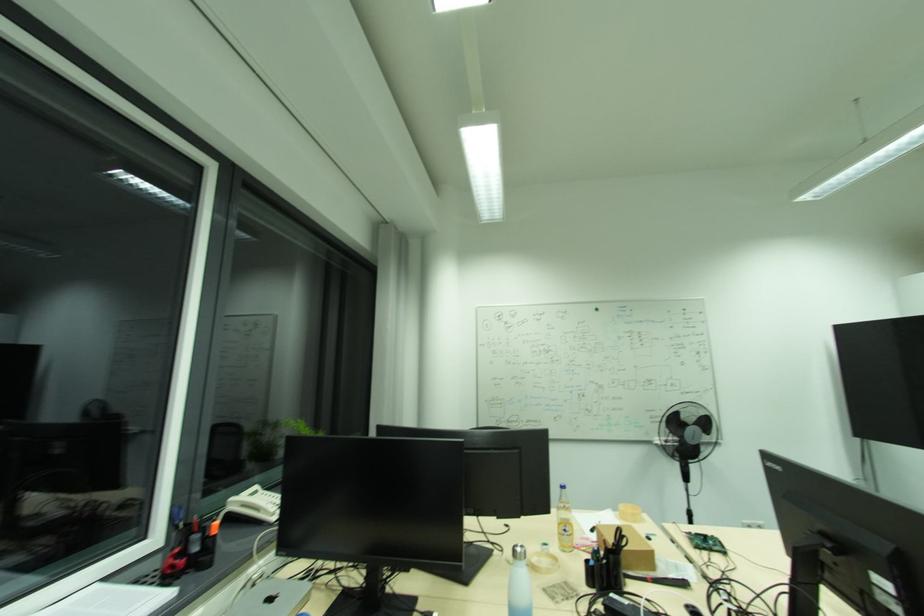
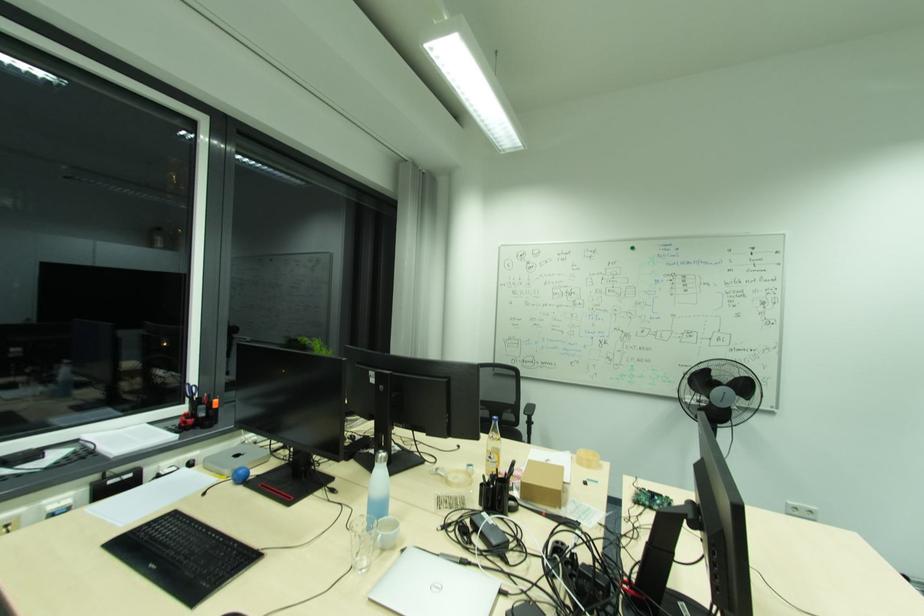
Find the pixel in the second image that matches [710,424] in the first image.

(748, 387)